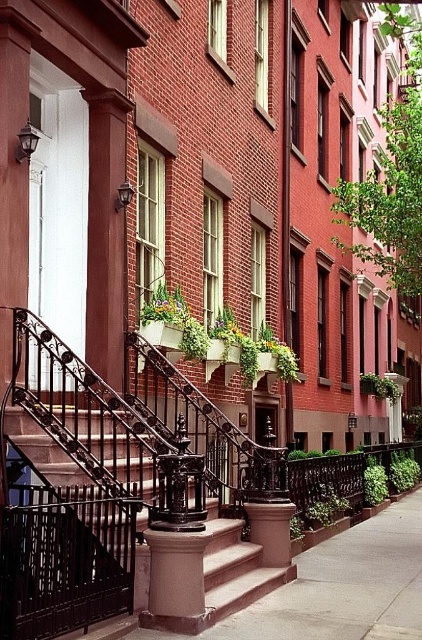
You are standing at the entrance of the townhouse and want to know the exact location of the smooth concrete steps at center. What are their coordinates?

The smooth concrete steps at center are located at coordinates point (332, 589).

You are standing in front of the townhouses and want to enter one. There are two staircases in front of you, the smooth concrete steps at center and the polished bronze staircase at center. Which staircase is higher from the ground?

The smooth concrete steps at center is taller than the polished bronze staircase at center, so the smooth concrete steps at center is higher from the ground.

You are standing at the entrance of the townhouse and looking towards the street. There are two points marked on the image, point (x=413, y=620) and point (x=24, y=422). Which point is closer to you?

Point (x=24, y=422) is closer to you because it is in front of point (x=413, y=620).